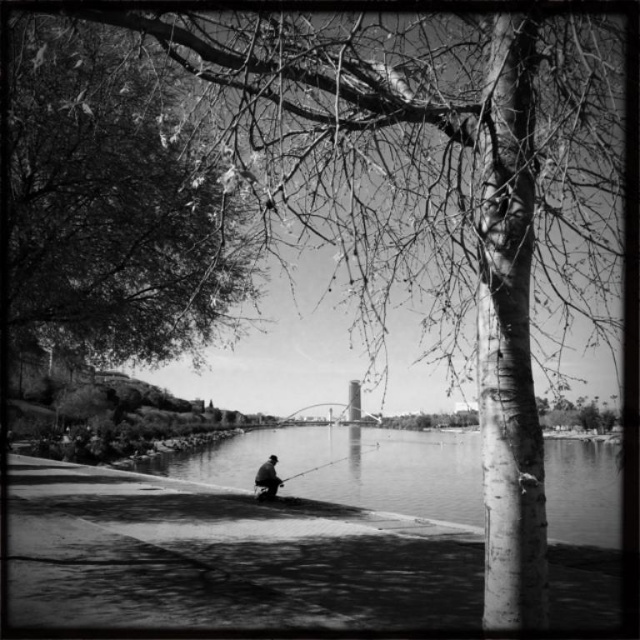
Does smooth water at lower center have a lesser width compared to smooth metallic fishing pole at center?

No.

Is point (580, 488) behind point (330, 461)?

No.

The image size is (640, 640). I want to click on smooth water at lower center, so click(x=348, y=467).

Who is more distant from viewer, (256,490) or (378,448)?

The point (378,448) is more distant.

Measure the distance from dark gray fabric fisherman at center to smooth metallic fishing pole at center.

dark gray fabric fisherman at center and smooth metallic fishing pole at center are 1.63 meters apart from each other.

Locate an element on the screen. dark gray fabric fisherman at center is located at coordinates (266, 480).

Between smooth bark tree at upper left and smooth water at lower center, which one has less height?

Standing shorter between the two is smooth water at lower center.

Between point (125, 308) and point (604, 445), which one is positioned behind?

The point (604, 445) is more distant.

Where is `smooth bark tree at upper left`? The height and width of the screenshot is (640, 640). smooth bark tree at upper left is located at coordinates (115, 200).